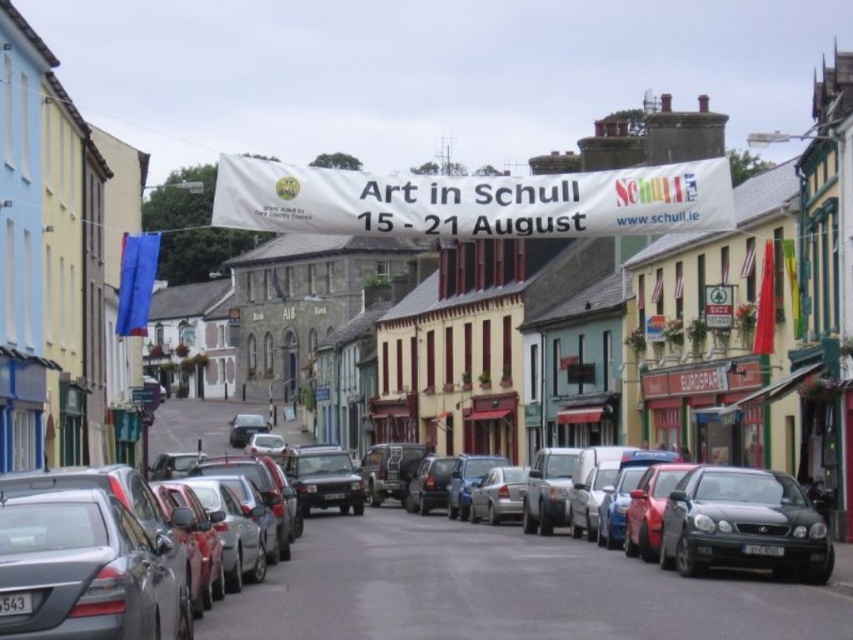
Question: From the image, what is the correct spatial relationship of shiny black sedan at center in relation to shiny black sedan at right?

Choices:
 (A) above
 (B) below

Answer: (B)

Question: Which point is closer to the camera taking this photo?

Choices:
 (A) (779, 573)
 (B) (585, 547)

Answer: (A)

Question: Considering the relative positions of shiny black sedan at center and shiny black sedan at right in the image provided, where is shiny black sedan at center located with respect to shiny black sedan at right?

Choices:
 (A) right
 (B) left

Answer: (B)

Question: Can you confirm if shiny black sedan at center is thinner than shiny black sedan at right?

Choices:
 (A) no
 (B) yes

Answer: (A)

Question: Which object is closer to the camera taking this photo?

Choices:
 (A) shiny black sedan at center
 (B) shiny black sedan at right

Answer: (A)